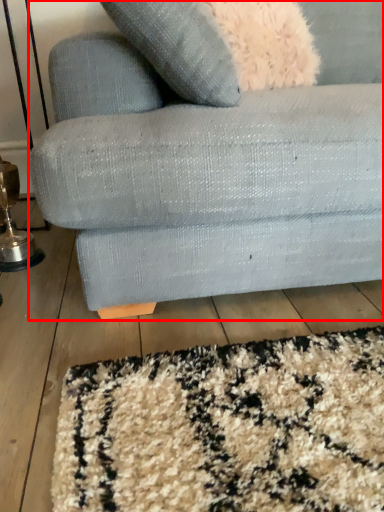
Question: Where is studio couch (annotated by the red box) located in relation to table lamp in the image?

Choices:
 (A) right
 (B) left

Answer: (A)